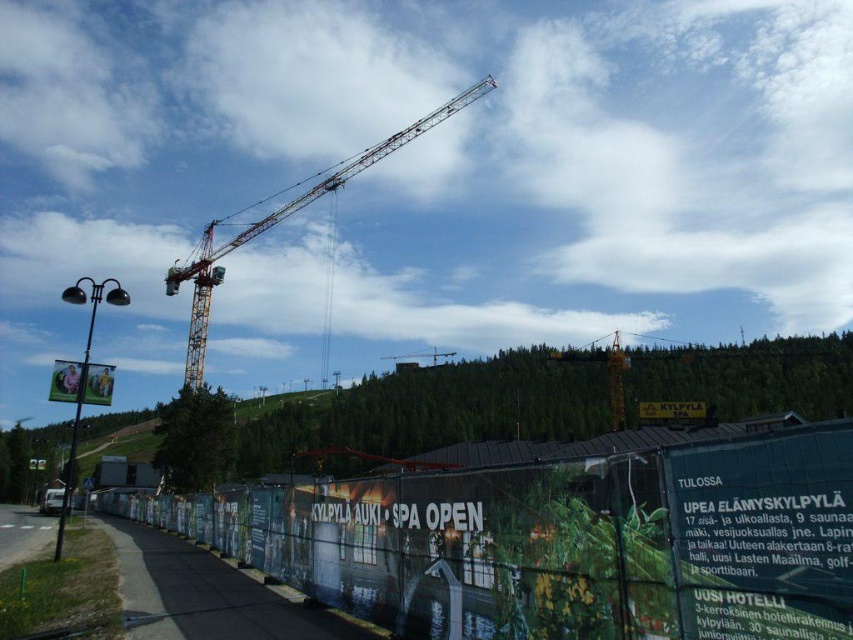
Does green fabric fence at lower center appear on the right side of yellow metallic crane at center?

In fact, green fabric fence at lower center is to the left of yellow metallic crane at center.

Who is positioned more to the right, green fabric fence at lower center or yellow metallic crane at center?

Positioned to the right is yellow metallic crane at center.

Is point (454, 496) farther from viewer compared to point (410, 355)?

No, (454, 496) is in front of (410, 355).

Identify the location of green fabric fence at lower center. (560, 541).

Is green fabric fence at lower center below red plastic sign at center?

No, green fabric fence at lower center is not below red plastic sign at center.

Who is taller, green fabric fence at lower center or red plastic sign at center?

green fabric fence at lower center is taller.

This screenshot has width=853, height=640. Identify the location of green fabric fence at lower center. (x=560, y=541).

The width and height of the screenshot is (853, 640). Find the location of `green fabric fence at lower center`. green fabric fence at lower center is located at coordinates (560, 541).

Is green fabric fence at lower center to the left of yellow metallic crane at upper center from the viewer's perspective?

No, green fabric fence at lower center is not to the left of yellow metallic crane at upper center.

Between green fabric fence at lower center and yellow metallic crane at upper center, which one appears on the left side from the viewer's perspective?

Positioned to the left is yellow metallic crane at upper center.

Between point (735, 470) and point (204, 240), which one is positioned behind?

Point (204, 240)

Image resolution: width=853 pixels, height=640 pixels. What are the coordinates of `green fabric fence at lower center` in the screenshot? It's located at (560, 541).